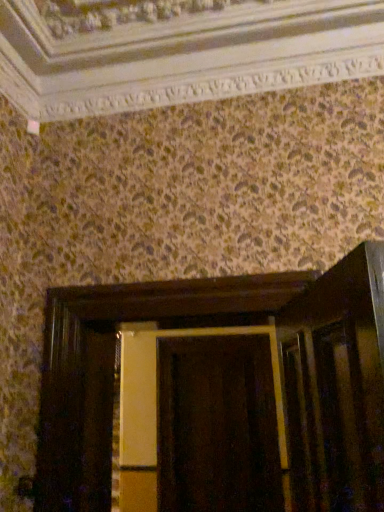
Where is `matte yellow elevator at center`? Image resolution: width=384 pixels, height=512 pixels. matte yellow elevator at center is located at coordinates (217, 394).

Image resolution: width=384 pixels, height=512 pixels. Describe the element at coordinates (217, 394) in the screenshot. I see `matte yellow elevator at center` at that location.

The height and width of the screenshot is (512, 384). I want to click on matte yellow elevator at center, so click(x=217, y=394).